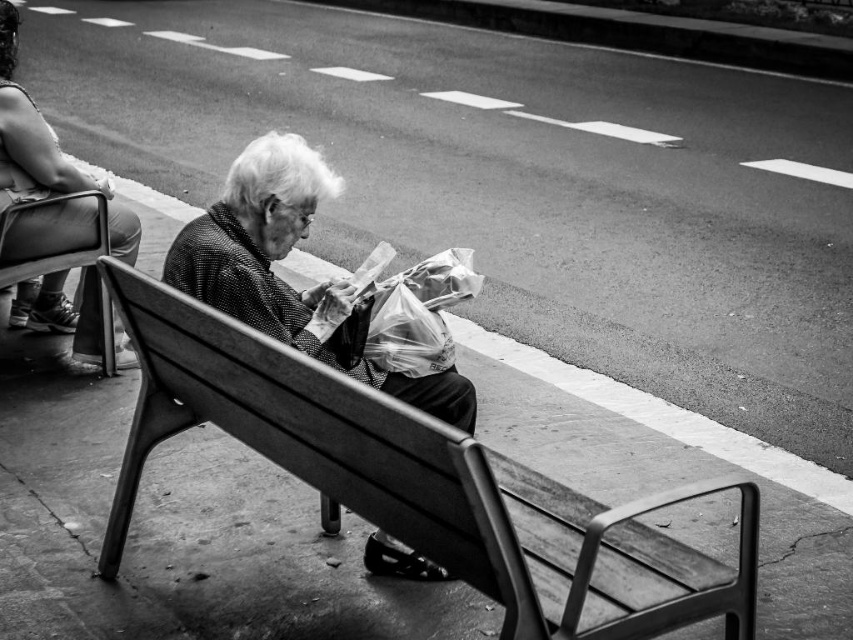
Question: Among these objects, which one is farthest from the camera?

Choices:
 (A) smooth fabric sweater at center
 (B) wooden bench at center

Answer: (A)

Question: Is wooden bench at center behind smooth fabric sweater at center?

Choices:
 (A) no
 (B) yes

Answer: (A)

Question: Which point is closer to the camera?

Choices:
 (A) matte black jacket at upper left
 (B) wooden bench at center
 (C) smooth fabric sweater at center

Answer: (B)

Question: Based on their relative distances, which object is farther from the matte black jacket at upper left?

Choices:
 (A) wooden bench at center
 (B) smooth fabric sweater at center

Answer: (A)

Question: Does wooden bench at center come behind matte black jacket at upper left?

Choices:
 (A) yes
 (B) no

Answer: (B)

Question: Is smooth fabric sweater at center to the right of matte black jacket at upper left from the viewer's perspective?

Choices:
 (A) yes
 (B) no

Answer: (A)